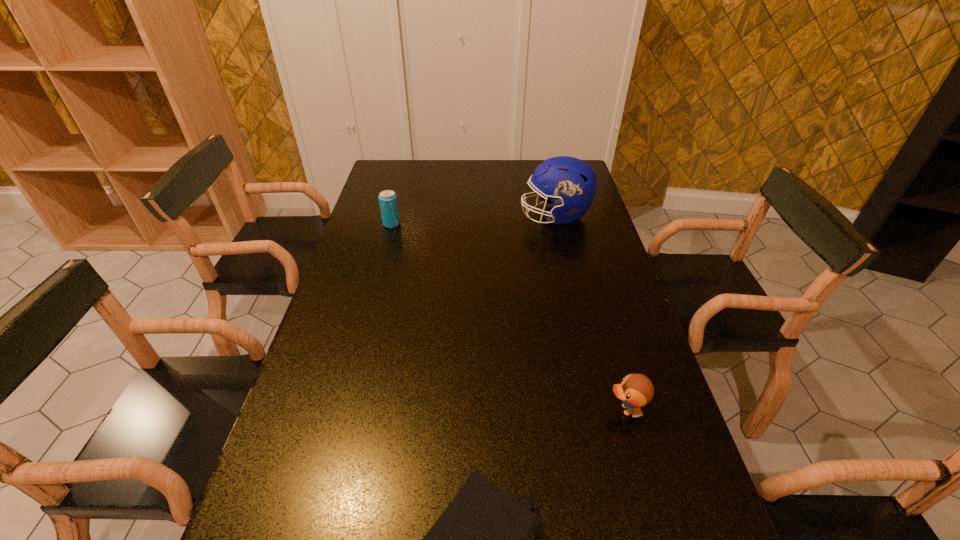
You are a GUI agent. You are given a task and a screenshot of the screen. Output one action in this format:
    pyautogui.click(x=<x>, y=<y>)
    Task: Click on the object located at the left edge
    
    Given the screenshot: What is the action you would take?
    pyautogui.click(x=387, y=199)

You are a GUI agent. You are given a task and a screenshot of the screen. Output one action in this format:
    pyautogui.click(x=<x>, y=<y>)
    Task: Click on the football helmet at the right edge
    
    Given the screenshot: What is the action you would take?
    (x=571, y=183)

This screenshot has height=540, width=960. In order to click on duck that is at the right edge in this screenshot , I will do `click(636, 390)`.

The width and height of the screenshot is (960, 540). In the image, there is a desktop. In order to click on vacant space at the far edge in this screenshot , I will do (462, 168).

In the image, there is a desktop. Where is `free space at the left edge`? Image resolution: width=960 pixels, height=540 pixels. free space at the left edge is located at coordinates (352, 428).

The image size is (960, 540). I want to click on vacant region at the right edge, so click(x=608, y=338).

Find the location of a particular element. The image size is (960, 540). free space between the leftmost object and the tallest object is located at coordinates (473, 220).

Locate an element on the screen. The image size is (960, 540). free area in between the soda can and the football helmet is located at coordinates (473, 220).

Locate an element on the screen. The image size is (960, 540). free space between the leftmost object and the duck is located at coordinates (509, 317).

Where is `vacant area that lies between the leftmost object and the third farthest object`? The width and height of the screenshot is (960, 540). vacant area that lies between the leftmost object and the third farthest object is located at coordinates (509, 317).